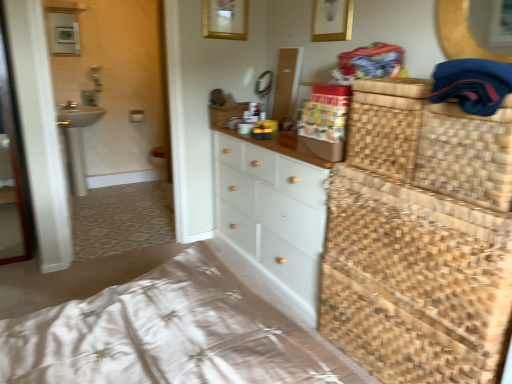
Find the location of a particular element. empty space that is ontop of woven straw basket at center, the first basket from the back is located at coordinates (231, 107).